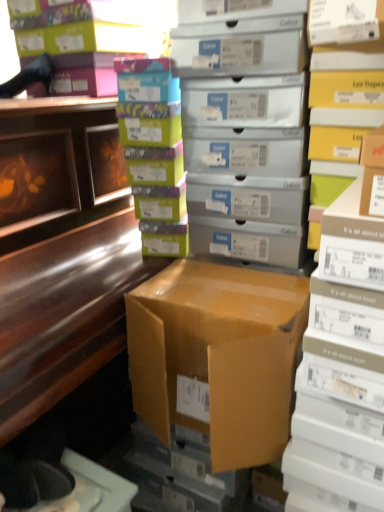
You are a GUI agent. You are given a task and a screenshot of the screen. Output one action in this format:
    pyautogui.click(x=<x>, y=<y>)
    Task: Click on the empty space that is ontop of brown cardboard box at center
    
    Given the screenshot: What is the action you would take?
    pyautogui.click(x=231, y=293)